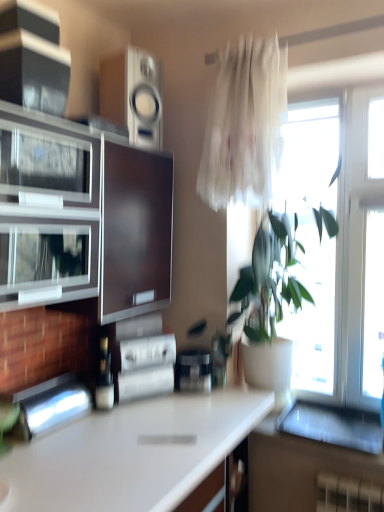
Identify the location of vacant space situated above white glossy computer desk at lower right (from a real-world perspective). The width and height of the screenshot is (384, 512). (307, 416).